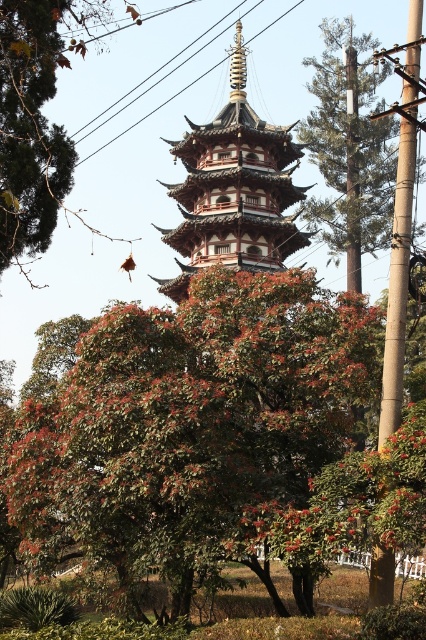
Consider the image. Can you confirm if green glossy tree at center is bigger than brown matte tree at upper left?

No, green glossy tree at center is not bigger than brown matte tree at upper left.

Can you confirm if green glossy tree at center is positioned to the left of brown matte tree at upper left?

In fact, green glossy tree at center is to the right of brown matte tree at upper left.

Who is more distant from viewer, (354, 467) or (31, 221)?

Positioned behind is point (31, 221).

The width and height of the screenshot is (426, 640). I want to click on green glossy tree at center, so click(x=203, y=436).

Between green textured tree at upper right and bamboo pole at right, which one is positioned lower?

bamboo pole at right is below.

Identify the location of green textured tree at upper right. This screenshot has width=426, height=640. (350, 147).

Is point (91, 368) positioned behind point (247, 106)?

No.

Does green glossy tree at center appear over wooden pagoda at center?

No.

At what (x,y) coordinates should I click in order to perform the action: click on green glossy tree at center. Please return your answer as a coordinate pair (x, y). Looking at the image, I should click on (203, 436).

At what (x,y) coordinates should I click in order to perform the action: click on green glossy tree at center. Please return your answer as a coordinate pair (x, y). The width and height of the screenshot is (426, 640). Looking at the image, I should click on 203,436.